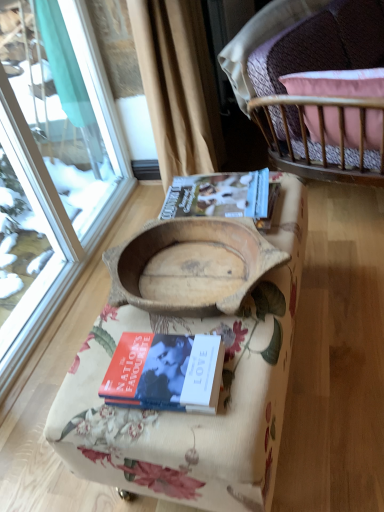
I want to click on vacant area on top of matte brown book at center, acting as the first book starting from the top (from a real-world perspective), so click(211, 202).